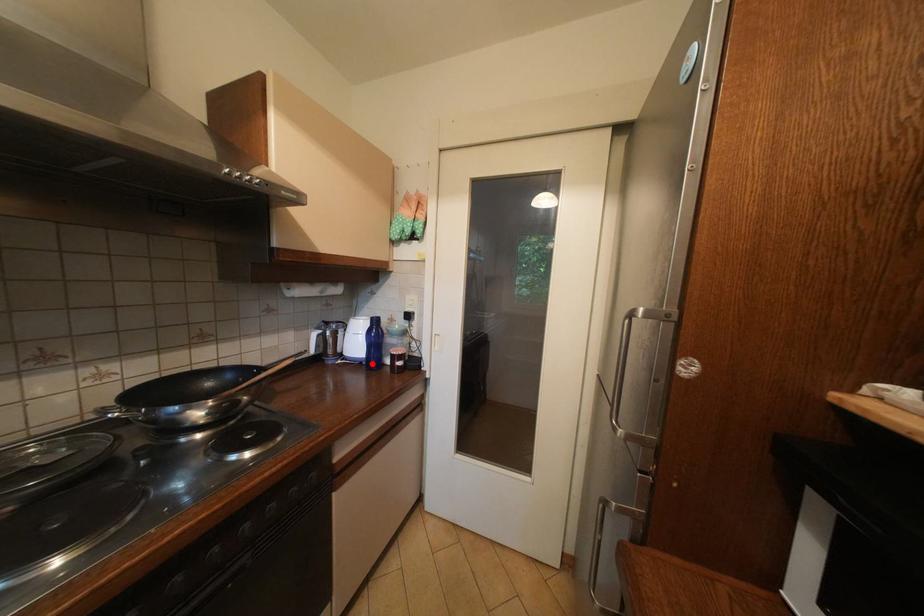
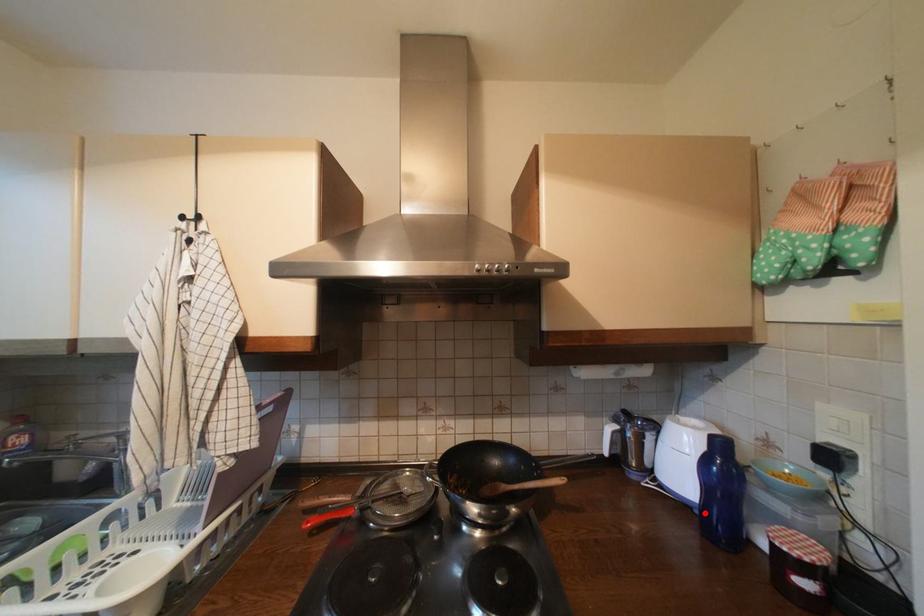
I am providing you with two images of the same scene from different viewpoints. A red point is marked on the first image and another point is marked on the second image. Do the highlighted points in image1 and image2 indicate the same real-world spot?

Yes